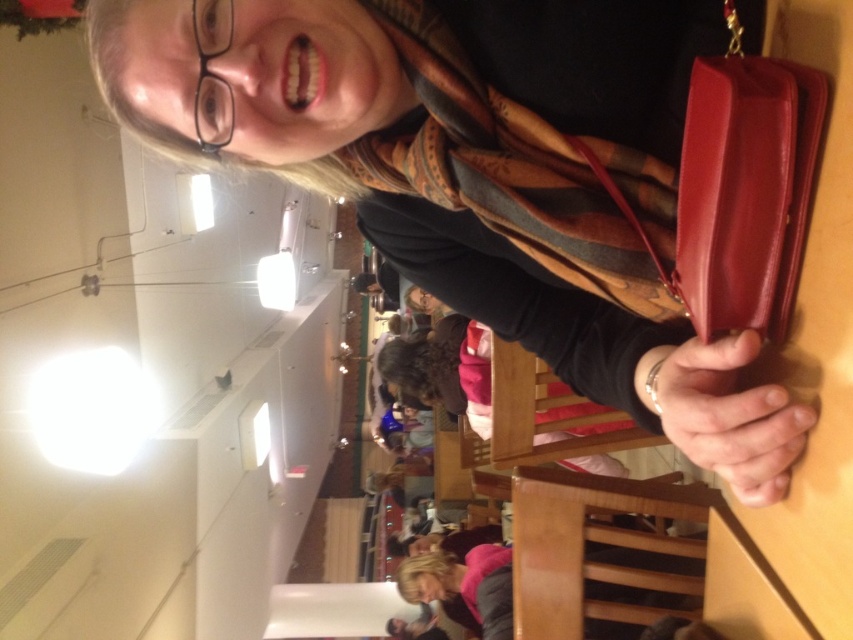
Question: Is plaid wool scarf at upper right above leather handbag at right?

Choices:
 (A) yes
 (B) no

Answer: (B)

Question: Which of the following is the closest to the observer?

Choices:
 (A) (622, 260)
 (B) (776, 102)

Answer: (B)

Question: Does plaid wool scarf at upper right appear on the left side of leather handbag at right?

Choices:
 (A) no
 (B) yes

Answer: (B)

Question: Which point is closer to the camera?

Choices:
 (A) plaid wool scarf at upper right
 (B) leather handbag at right

Answer: (B)

Question: Does plaid wool scarf at upper right have a greater width compared to leather handbag at right?

Choices:
 (A) yes
 (B) no

Answer: (A)

Question: Which object appears closest to the camera in this image?

Choices:
 (A) leather handbag at right
 (B) plaid wool scarf at upper right

Answer: (A)